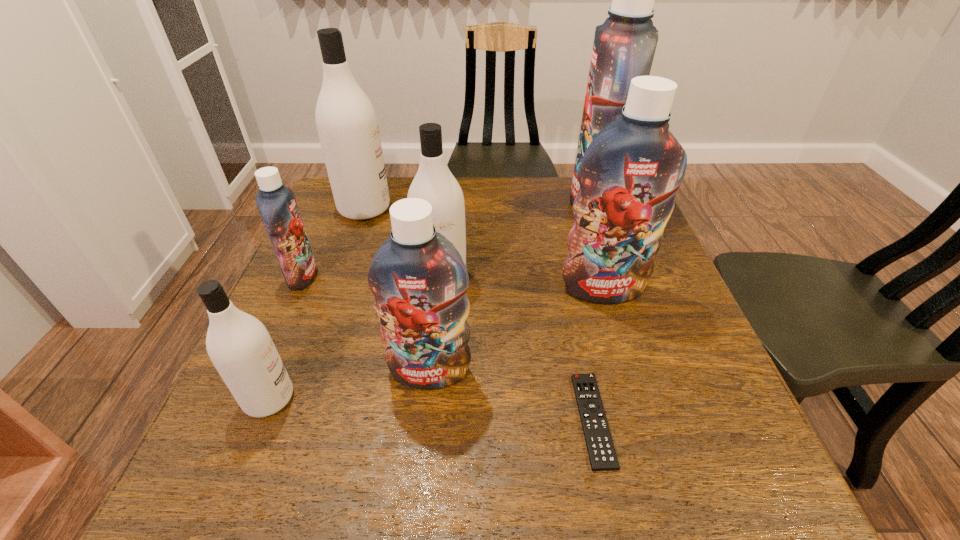
Identify the location of the shortest object. This screenshot has height=540, width=960. (601, 451).

Find the location of a particular element. This screenshot has height=540, width=960. blank area located on the front label of the biggest blue shampoo is located at coordinates pos(510,205).

Locate an element on the screen. vacant space located 0.350m on the front label of the biggest blue shampoo is located at coordinates (446, 205).

I want to click on vacant space located on the front label of the biggest blue shampoo, so click(436, 205).

Locate an element on the screen. The image size is (960, 540). vacant area situated on the front-facing side of the biggest white shampoo is located at coordinates (498, 208).

Find the location of a particular element. free spot located on the front label of the third smallest blue shampoo is located at coordinates (666, 498).

Locate an element on the screen. The width and height of the screenshot is (960, 540). vacant space located 0.340m on the front-facing side of the second nearest white shampoo is located at coordinates (425, 440).

Identify the location of free space located on the front label of the second smallest blue shampoo. This screenshot has width=960, height=540. point(422,438).

Identify the location of free space located 0.360m on the front label of the leftmost blue shampoo. (472, 276).

Find the location of a particular element. This screenshot has width=960, height=540. vacant position located 0.380m on the front-facing side of the smallest white shampoo is located at coordinates (508, 398).